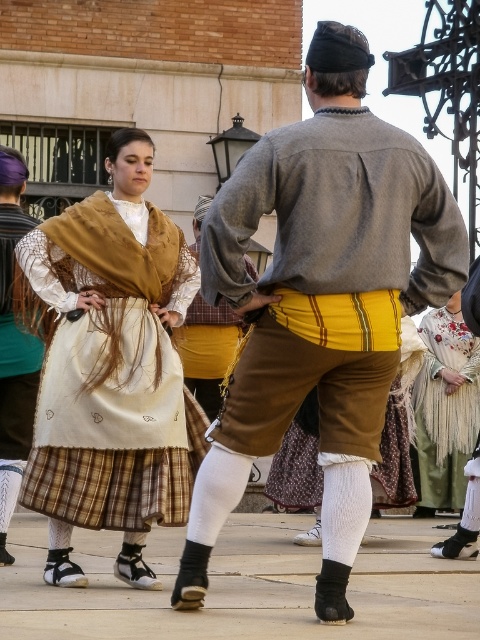
In the scene shown: You are organizing a photo shoot and need to arrange two models wearing the matte gray sweater at center and the matte brown fabric dress at center. Based on the scene description, which clothing item might require more space for a wide pose?

The matte gray sweater at center might require more space for a wide pose since it is wider than the matte brown fabric dress at center according to the description.

You are a photographer standing 10 meters away from the scene. You want to take a photo that includes both the embroidered silk dress at center and the yellow cotton shirt at center. Can you capture both in a single frame without moving your position? Explain your reasoning.

The distance between the embroidered silk dress at center and the yellow cotton shirt at center is 13.89 meters. Since you are standing 10 meters away from the scene, the total width required to capture both would exceed your camera frame unless using a wide angle lens. However, standard camera framing at this distance might not accommodate the 13.89 meter gap. Therefore, it may not be possible without moving closer or using specialized equipment.

You are a photographer setting up a shoot in the described scene. You need to position a backdrop that must be taller than both dresses. Given that the matte brown fabric dress at center is taller than the embroidered silk dress at center, what is the minimum height the backdrop should be?

The backdrop must be taller than the taller of the two dresses. Since the matte brown fabric dress at center is taller than the embroidered silk dress at center, the minimum height should be just over the height of the matte brown fabric dress at center to accommodate both.